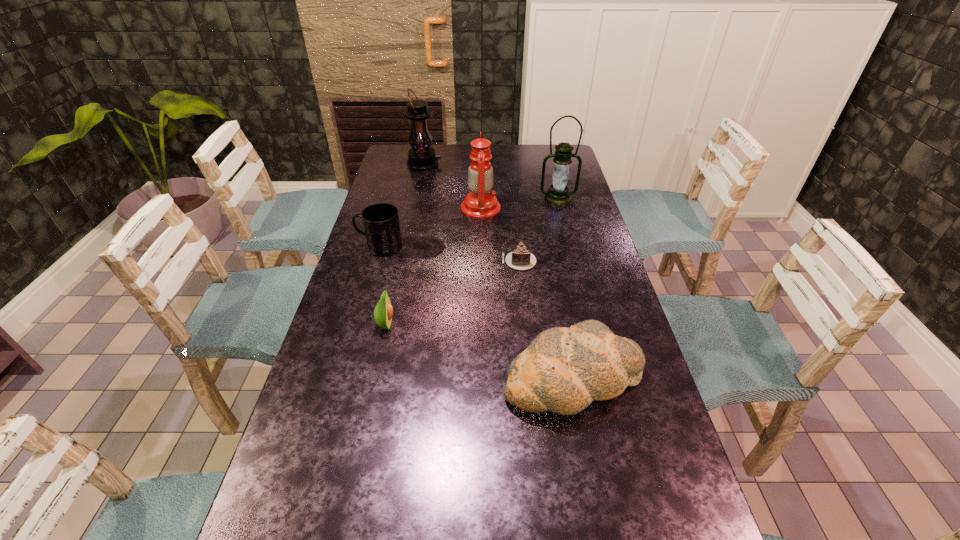
Identify the location of the right lantern. The height and width of the screenshot is (540, 960). (558, 194).

You are a GUI agent. You are given a task and a screenshot of the screen. Output one action in this format:
    pyautogui.click(x=<x>, y=<y>)
    Task: Click on the left lantern
    
    Given the screenshot: What is the action you would take?
    pyautogui.click(x=421, y=157)

At what (x,y) coordinates should I click in order to perform the action: click on the farther lantern. Please return your answer as a coordinate pair (x, y). Looking at the image, I should click on (421, 157).

Identify the location of oil lamp. (480, 203).

Where is `mug`? This screenshot has width=960, height=540. mug is located at coordinates (381, 224).

The image size is (960, 540). Identify the location of bread. (563, 370).

Where is `avocado`? avocado is located at coordinates (383, 312).

Where is `chocolate cake`? The height and width of the screenshot is (540, 960). chocolate cake is located at coordinates (520, 258).

You are a GUI agent. You are given a task and a screenshot of the screen. Output one action in this format:
    pyautogui.click(x=<x>, y=<y>)
    Task: Click on the free region located 0.130m on the side where the right lantern emits light
    Image resolution: width=960 pixels, height=540 pixels.
    Given the screenshot: What is the action you would take?
    pyautogui.click(x=564, y=224)

Point to any free space located 0.340m above the left lantern, indicating its light source in the image. Please provide its 2D coordinates. Your answer should be formatted as a tuple, i.e. [(x, y)], where the tuple contains the x and y coordinates of a point satisfying the conditions above.

[(518, 164)]